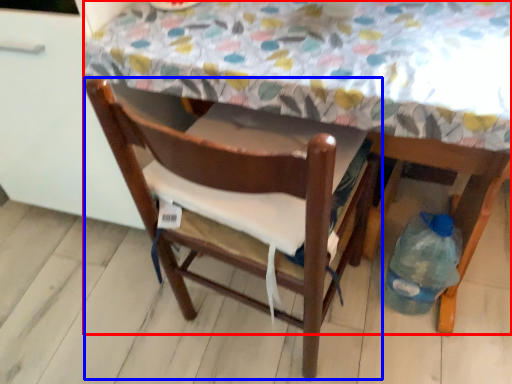
Question: Which point is further to the camera, table (highlighted by a red box) or chair (highlighted by a blue box)?

Choices:
 (A) table
 (B) chair

Answer: (B)